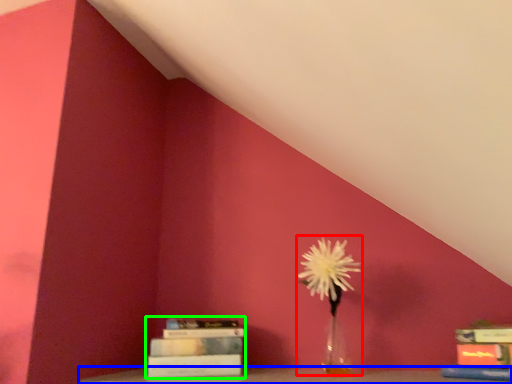
Question: Considering the real-world distances, which object is farthest from floral arrangement (highlighted by a red box)? furniture (highlighted by a blue box) or book (highlighted by a green box)?

Choices:
 (A) furniture
 (B) book

Answer: (B)